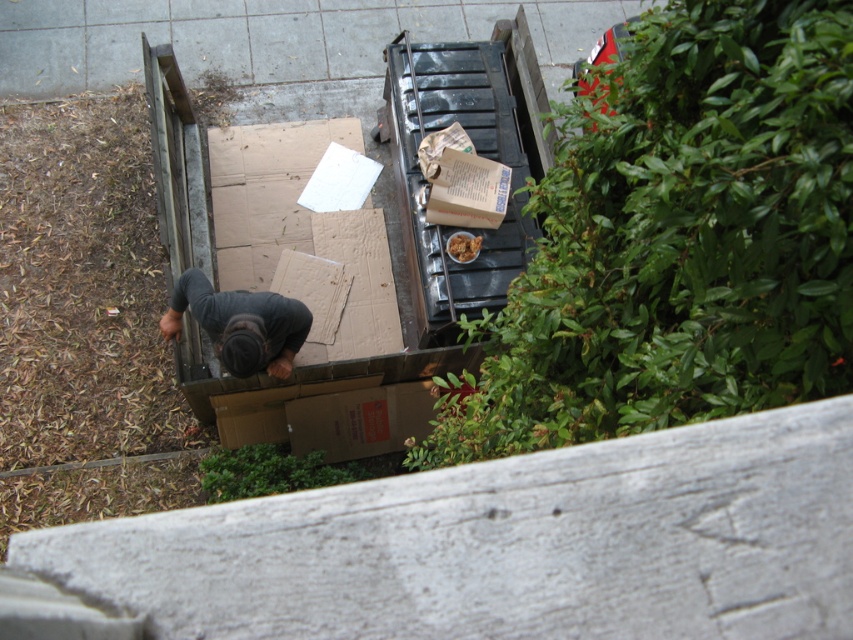
You are a landscape architect designing a garden. You want to place a new shrub in the area where the green leafy bush at upper right and dark gray fabric at lower center are located. Which object should you consider for spacing due to its larger width?

The green leafy bush at upper right should be considered for spacing because its width is larger than the dark gray fabric at lower center.

You are a gardener who needs to choose between two green leafy bushes to trim. The bushes are the green leafy bush at upper right and the green leafy bush at lower center. Which bush should you prioritize if you want to work on the smaller one first?

The green leafy bush at lower center is smaller in size compared to the green leafy bush at upper right, so you should prioritize trimming the green leafy bush at lower center first.